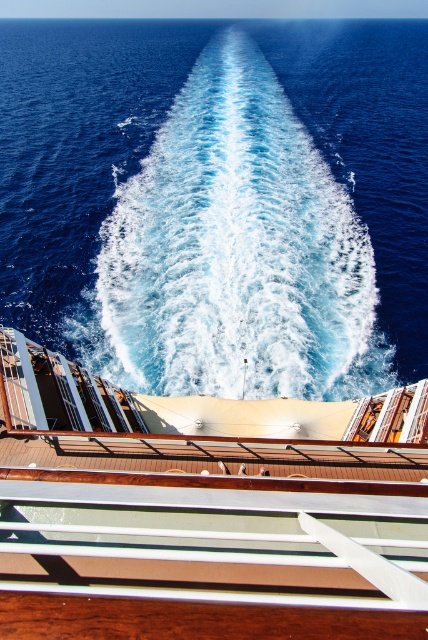
You are standing on the deck of the cruise ship and want to locate the blue liquid water at center. According to the coordinates provided, where should you look relative to your position?

The blue liquid water at center is located at coordinates point (219,200), which is to your lower center direction from your current position on the deck.

You are standing on the deck of the cruise ship and want to look at the open sea. Which object should you look towards, the blue liquid water at center or the brown wooden deck at center?

You should look towards the blue liquid water at center because it is above the brown wooden deck at center, making it visible from your position on the deck.

You are standing on the cruise ship deck and want to take a photo of the blue liquid water at center and the brown wooden deck at center. Which object will appear closer to you in the photo?

The blue liquid water at center will appear closer to you in the photo because it is further to the viewer than the brown wooden deck at center.